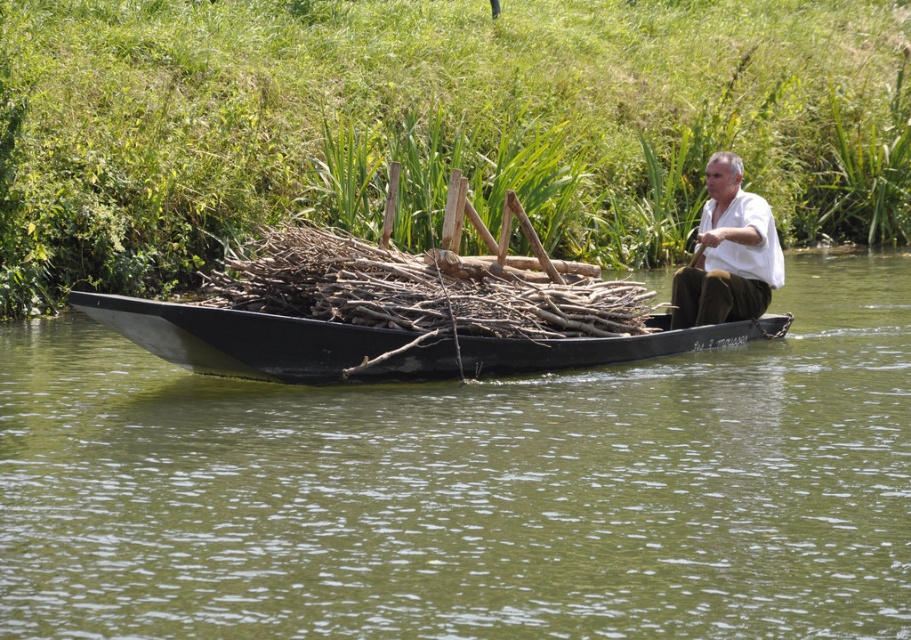
You are standing on the riverbank and want to throw a lifebuoy to the man in the boat. The lifebuoy has a diameter of 1 meter. If you aim directly at the white matte shirt at upper center, will the lifebuoy land near the brown rough wood at center?

The brown rough wood at center and white matte shirt at upper center are 7.37 meters apart from each other. Since the lifebuoy has a diameter of 1 meter, the distance between them is much larger than the lifebuoy size. Therefore, aiming at the white matte shirt at upper center would not result in the lifebuoy landing near the brown rough wood at center.